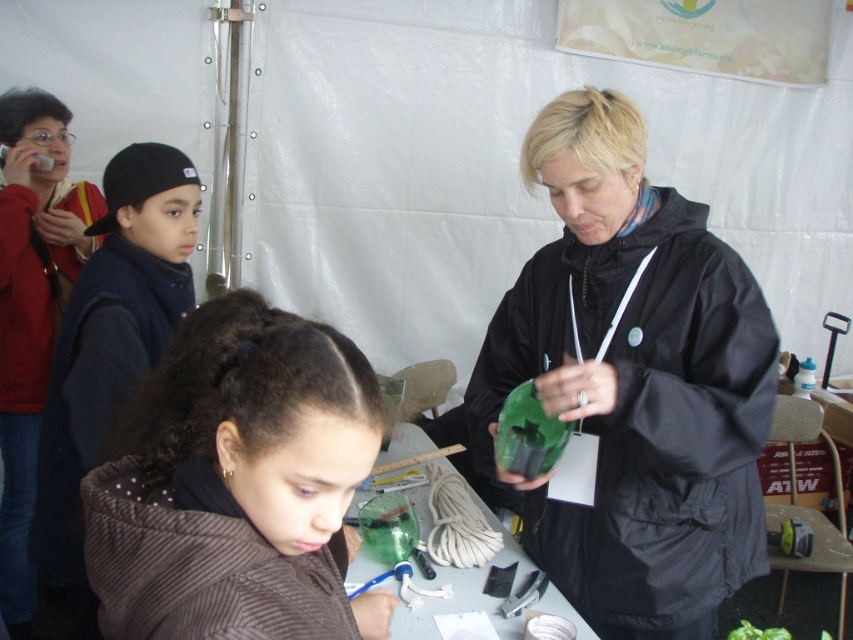
Can you confirm if green matte mask at center is positioned to the right of matte red jacket at upper left?

Yes, green matte mask at center is to the right of matte red jacket at upper left.

The image size is (853, 640). What do you see at coordinates (633, 381) in the screenshot?
I see `green matte mask at center` at bounding box center [633, 381].

Is point (770, 356) positioned before point (26, 577)?

That is True.

You are a GUI agent. You are given a task and a screenshot of the screen. Output one action in this format:
    pyautogui.click(x=<x>, y=<y>)
    Task: Click on the green matte mask at center
    The height and width of the screenshot is (640, 853).
    Given the screenshot: What is the action you would take?
    pyautogui.click(x=633, y=381)

Does point (76, 577) lie in front of point (434, 634)?

That is False.

Is black fleece jacket at left wider than translucent plastic bottle at center?

Incorrect, black fleece jacket at left's width does not surpass translucent plastic bottle at center's.

Is point (123, 374) behind point (570, 618)?

That is True.

I want to click on black fleece jacket at left, so click(x=109, y=346).

Does black fleece jacket at left have a larger size compared to matte red jacket at upper left?

Actually, black fleece jacket at left might be smaller than matte red jacket at upper left.

Find the location of a particular element. The image size is (853, 640). black fleece jacket at left is located at coordinates (109, 346).

Between point (120, 371) and point (0, 138), which one is positioned behind?

The point (0, 138) is behind.

The image size is (853, 640). In order to click on black fleece jacket at left in this screenshot , I will do click(109, 346).